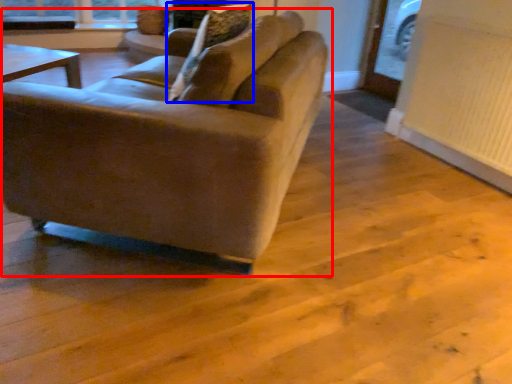
Question: Which of the following is the closest to the observer, studio couch (highlighted by a red box) or pillow (highlighted by a blue box)?

Choices:
 (A) studio couch
 (B) pillow

Answer: (A)